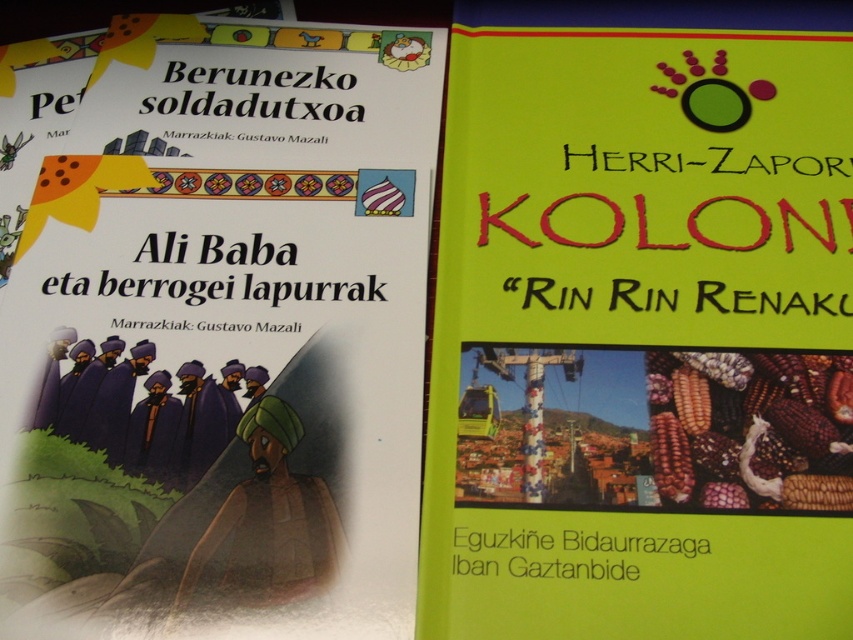
Question: Observing the image, what is the correct spatial positioning of green matte book cover at right in reference to matte paper book cover at left?

Choices:
 (A) left
 (B) right

Answer: (B)

Question: Which object appears farthest from the camera in this image?

Choices:
 (A) green matte book cover at right
 (B) matte paper book cover at left

Answer: (B)

Question: Which point appears farthest from the camera in this image?

Choices:
 (A) (602, 618)
 (B) (242, 534)

Answer: (B)

Question: Which point is closer to the camera?

Choices:
 (A) (204, 307)
 (B) (584, 545)

Answer: (B)

Question: Is green matte book cover at right below matte paper book cover at left?

Choices:
 (A) no
 (B) yes

Answer: (A)

Question: Does green matte book cover at right lie behind matte paper book cover at left?

Choices:
 (A) no
 (B) yes

Answer: (A)